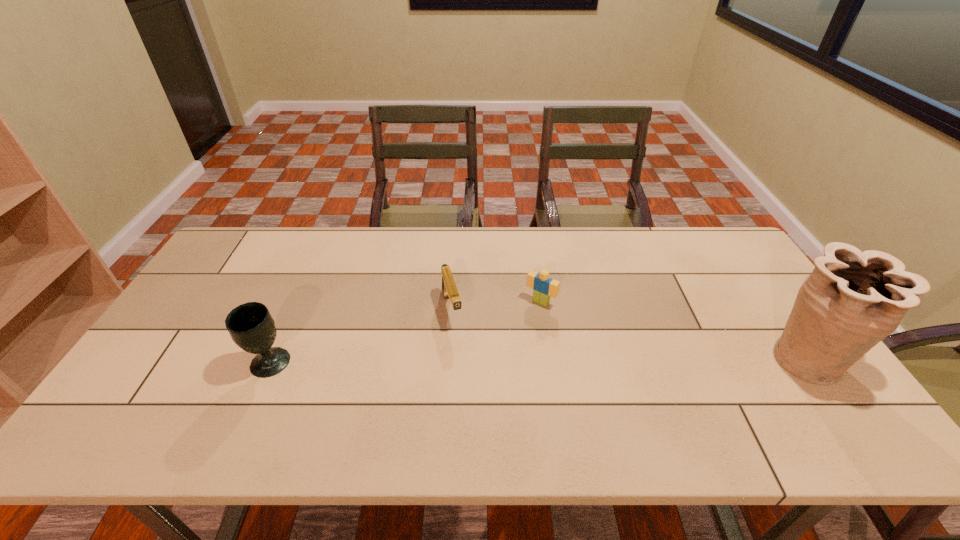
I want to click on the leftmost object, so click(250, 325).

At what (x,y) coordinates should I click in order to perform the action: click on chalice. Please return your answer as a coordinate pair (x, y). Looking at the image, I should click on (250, 325).

The width and height of the screenshot is (960, 540). In order to click on the rightmost object in this screenshot , I will do `click(852, 300)`.

Locate an element on the screen. Image resolution: width=960 pixels, height=540 pixels. the tallest object is located at coordinates (852, 300).

Image resolution: width=960 pixels, height=540 pixels. Identify the location of pistol. (449, 288).

Image resolution: width=960 pixels, height=540 pixels. In order to click on Lego in this screenshot , I will do `click(543, 287)`.

You are a GUI agent. You are given a task and a screenshot of the screen. Output one action in this format:
    pyautogui.click(x=<x>, y=<y>)
    Task: Click on the free point located on the right of the second tallest object
    This screenshot has height=540, width=960.
    Given the screenshot: What is the action you would take?
    [308, 363]

Where is `vacant space situated on the left of the rightmost object`? The image size is (960, 540). vacant space situated on the left of the rightmost object is located at coordinates (659, 359).

Where is `vacant space located 0.100m at the barrel of the second object from left to right`? vacant space located 0.100m at the barrel of the second object from left to right is located at coordinates (462, 359).

Where is `vacant space located at the barrel of the second object from left to right`? The width and height of the screenshot is (960, 540). vacant space located at the barrel of the second object from left to right is located at coordinates (473, 396).